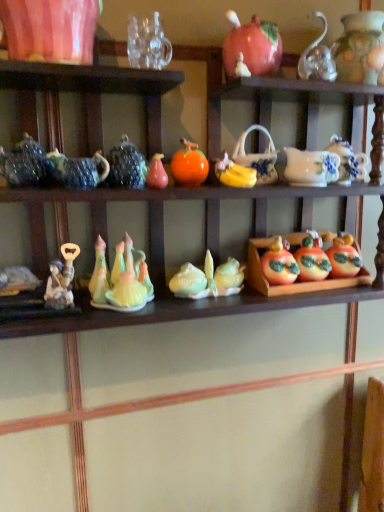
Question: Looking at the image, does black glossy teapot at upper center, arranged as the fourth tableware when viewed from the right, seem bigger or smaller compared to matte pink vase at upper left, the 1th tableware when ordered from left to right?

Choices:
 (A) big
 (B) small

Answer: (B)

Question: Do you think black glossy teapot at upper center, arranged as the second tableware when viewed from the left, is within matte pink vase at upper left, which is the fifth tableware in right-to-left order, or outside of it?

Choices:
 (A) inside
 (B) outside

Answer: (B)

Question: Considering the real-world distances, which object is farthest from the matte ceramic corn at center, the 2th toy from the back?

Choices:
 (A) pear-shaped ceramic at center, the 3th toy ordered from the bottom
 (B) matte ceramic apples at center, the first toy when ordered from right to left
 (C) matte ceramic pumpkin at upper center, placed as the second pumpkin when sorted from bottom to top
 (D) shiny ceramic apple at center right, which is the second fruit in front-to-back order
 (E) matte ceramic apples at center right

Answer: (C)

Question: Estimate the real-world distances between objects in this image. Which object is closer to the matte ceramic pumpkin at upper center, placed as the second pumpkin when sorted from bottom to top?

Choices:
 (A) matte ceramic apples at center, the 1th toy positioned from the back
 (B) matte ceramic pumpkin at center right, which is the 2th pumpkin in front-to-back order
 (C) transparent glass mug at upper center, which ranks as the 3th tableware in left-to-right order
 (D) black glossy teapot at upper center, arranged as the second tableware when viewed from the left
 (E) shiny ceramic apple at center right, which is counted as the first fruit, starting from the right

Answer: (C)